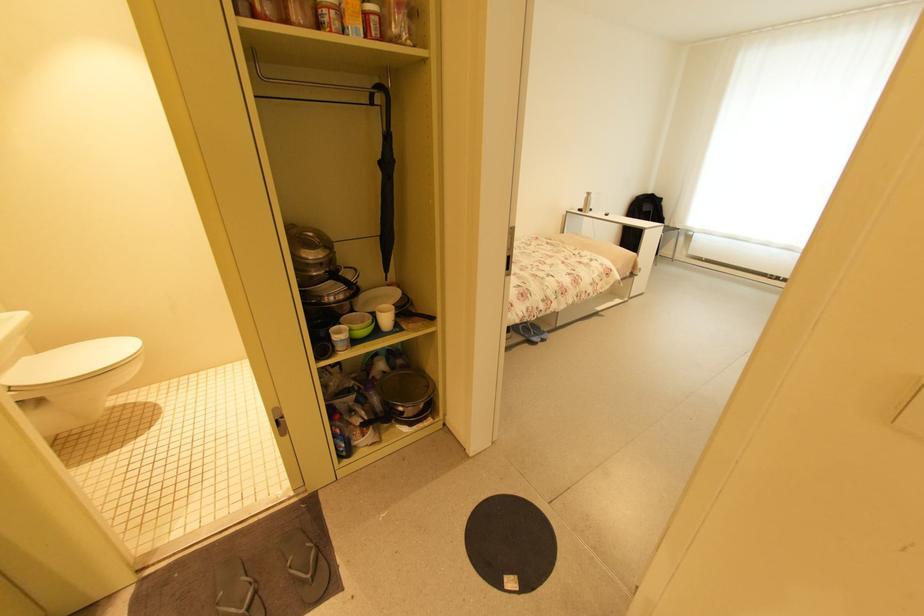
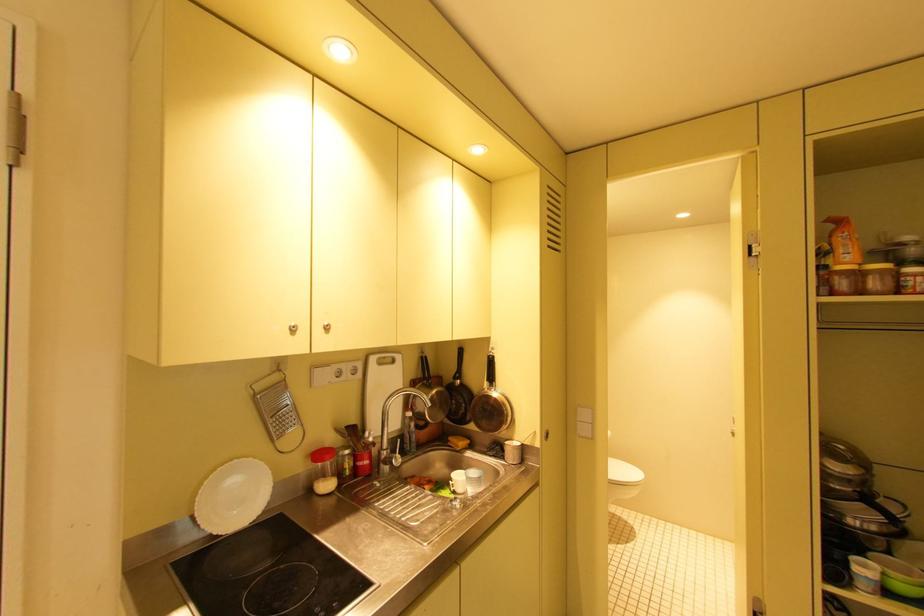
Question: The first image is from the beginning of the video and the second image is from the end. How did the camera likely rotate when shooting the video?

Choices:
 (A) Left
 (B) Right
 (C) Up
 (D) Down

Answer: (A)